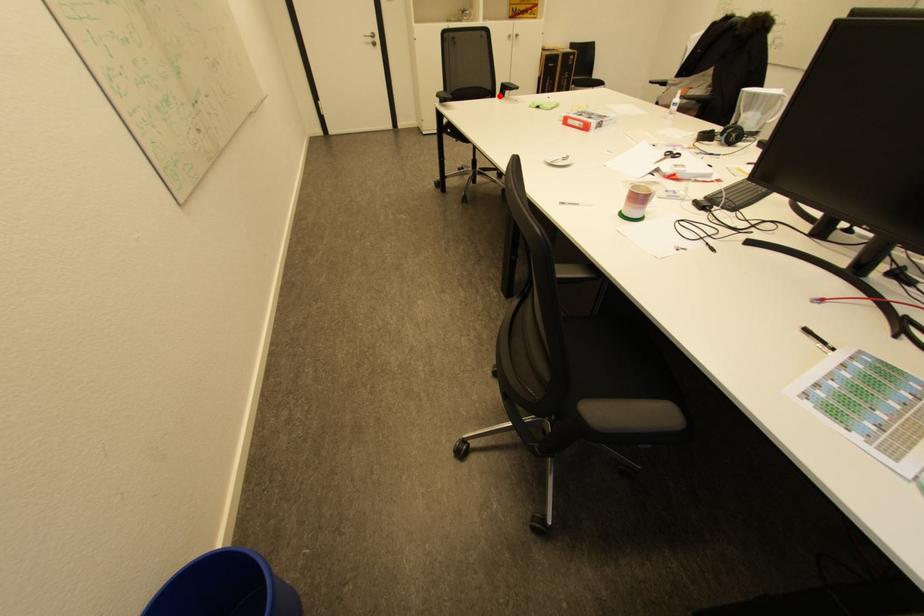
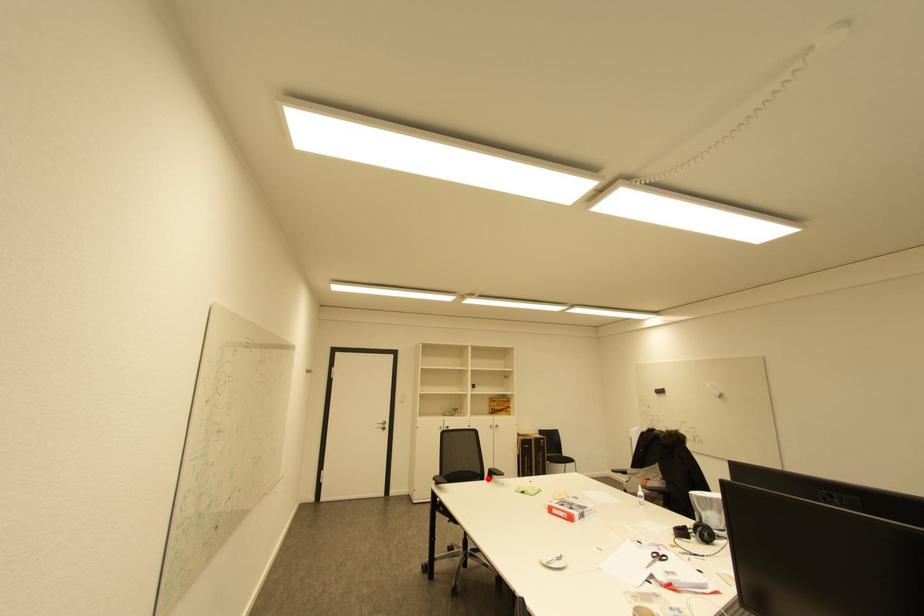
I am providing you with two images of the same scene from different viewpoints. A red point is marked on the first image and another point is marked on the second image. Are the points marked in image1 and image2 representing the same 3D position?

Yes